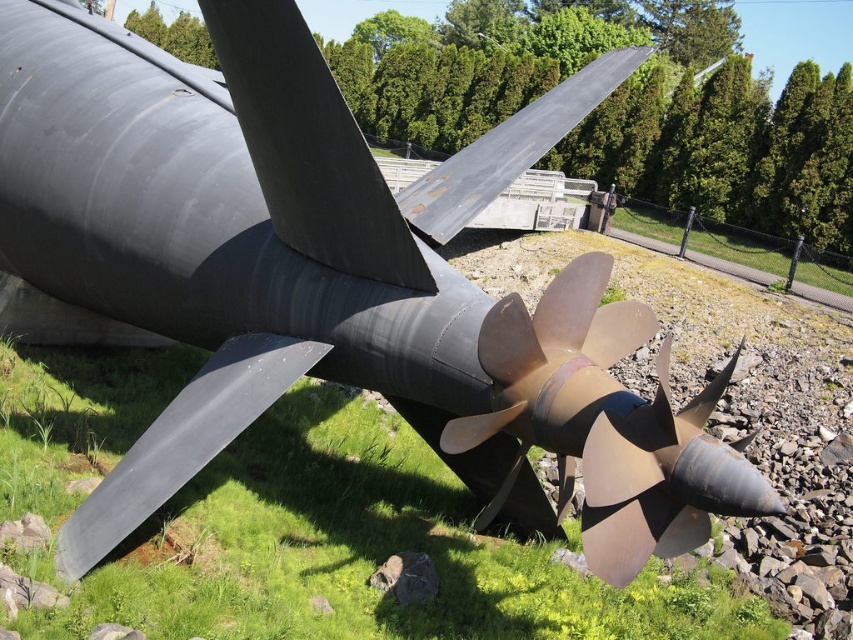
You are standing in front of the propeller and want to place a small flag at the point closer to you. Which point should you choose between point (701,499) and point (407,264)?

Point (701,499) is closer to the camera than point (407,264), so you should place the flag at point (701,499).

You are a maintenance worker needing to access the rusty metallic blade at upper center from the matte gold propeller at center. Given that your tool kit is 1.5 meters long, can you reach the blade without moving the propeller?

The distance between the matte gold propeller at center and the rusty metallic blade at upper center is 1.48 meters, so yes, the tool kit can reach the rusty metallic blade at upper center since it is shorter than the tool kit length.

You are an engineer inspecting a propeller in a park. You notice two parts labeled as matte gold propeller at center and matte black propeller blade at center. Which part is positioned more to the right side of the image?

The matte gold propeller at center is positioned more to the right side of the image than the matte black propeller blade at center.